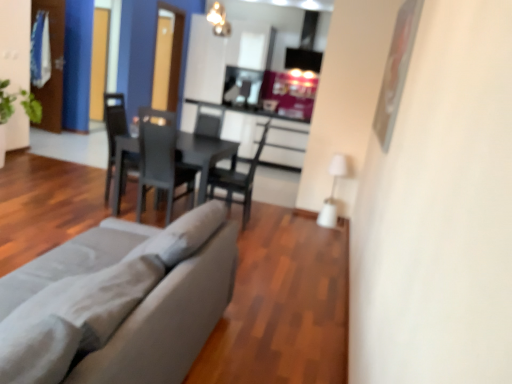
At what (x,y) coordinates should I click in order to perform the action: click on matte gray chair at center, which appears as the 1th chair when viewed from the right. Please return your answer as a coordinate pair (x, y). Image resolution: width=512 pixels, height=384 pixels. Looking at the image, I should click on (238, 179).

Where is `matte black armchair at center`? matte black armchair at center is located at coordinates (209, 120).

The image size is (512, 384). What do you see at coordinates (209, 120) in the screenshot? I see `matte black armchair at center` at bounding box center [209, 120].

Image resolution: width=512 pixels, height=384 pixels. I want to click on matte gray chair at center, which appears as the 1th chair when viewed from the right, so click(238, 179).

How distant is transparent glass door at upper left, which is the 1th glass door in left-to-right order, from black matte table at center?

They are 2.54 meters apart.

Can you confirm if transparent glass door at upper left, which is the 1th glass door in left-to-right order, is positioned to the left of black matte table at center?

Yes.

Can you confirm if transparent glass door at upper left, which is the second glass door in right-to-left order, is thinner than black matte table at center?

Correct, the width of transparent glass door at upper left, which is the second glass door in right-to-left order, is less than that of black matte table at center.

Considering the relative sizes of transparent glass door at upper left, which is the second glass door in right-to-left order, and black matte table at center in the image provided, is transparent glass door at upper left, which is the second glass door in right-to-left order, shorter than black matte table at center?

In fact, transparent glass door at upper left, which is the second glass door in right-to-left order, may be taller than black matte table at center.

From a real-world perspective, relative to matte black armchair at center, is transparent glass door at upper left, positioned as the 1th glass door in right-to-left order, vertically above or below?

In terms of real-world spatial position, transparent glass door at upper left, positioned as the 1th glass door in right-to-left order, is above matte black armchair at center.

Can you confirm if transparent glass door at upper left, positioned as the 2th glass door in left-to-right order, is thinner than matte black armchair at center?

Indeed, transparent glass door at upper left, positioned as the 2th glass door in left-to-right order, has a lesser width compared to matte black armchair at center.

Is transparent glass door at upper left, positioned as the 1th glass door in right-to-left order, facing towards matte black armchair at center?

No, transparent glass door at upper left, positioned as the 1th glass door in right-to-left order, is not aimed at matte black armchair at center.

Does point (181, 38) appear closer or farther from the camera than point (193, 101)?

Point (181, 38) is positioned farther from the camera compared to point (193, 101).

Looking at this image, which of these two, matte gray chair at center, which appears as the 1th chair when viewed from the right, or black matte table at center, is smaller?

matte gray chair at center, which appears as the 1th chair when viewed from the right.

Is matte gray chair at center, which appears as the 1th chair when viewed from the right, looking in the opposite direction of black matte table at center?

No, matte gray chair at center, which appears as the 1th chair when viewed from the right, is not facing away from black matte table at center.

Find the location of a particular element. This screenshot has width=512, height=384. table below the matte gray chair at center, the second chair positioned from the left (from a real-world perspective) is located at coordinates (203, 155).

From the image's perspective, is matte gray chair at center, the second chair positioned from the left, above or below black matte table at center?

Based on their image positions, matte gray chair at center, the second chair positioned from the left, is located above black matte table at center.

Between transparent glass door at upper left, positioned as the 2th glass door in left-to-right order, and matte gray chair at center, which appears as the 1th chair when viewed from the right, which one has smaller width?

With smaller width is transparent glass door at upper left, positioned as the 2th glass door in left-to-right order.

Considering the relative sizes of transparent glass door at upper left, positioned as the 1th glass door in right-to-left order, and matte gray chair at center, which appears as the 1th chair when viewed from the right, in the image provided, is transparent glass door at upper left, positioned as the 1th glass door in right-to-left order, shorter than matte gray chair at center, which appears as the 1th chair when viewed from the right,?

No, transparent glass door at upper left, positioned as the 1th glass door in right-to-left order, is not shorter than matte gray chair at center, which appears as the 1th chair when viewed from the right.

I want to click on the 2nd chair in front of the transparent glass door at upper left, positioned as the 2th glass door in left-to-right order, starting your count from the anchor, so click(238, 179).

How much distance is there between transparent glass door at upper left, positioned as the 2th glass door in left-to-right order, and matte gray chair at center, the second chair positioned from the left?

A distance of 2.43 meters exists between transparent glass door at upper left, positioned as the 2th glass door in left-to-right order, and matte gray chair at center, the second chair positioned from the left.

Considering the sizes of objects black matte table at center and gray fabric couch at lower left in the image provided, who is smaller, black matte table at center or gray fabric couch at lower left?

Smaller between the two is black matte table at center.

Is black matte table at center placed right next to gray fabric couch at lower left?

No.

Is black matte table at center wider than gray fabric couch at lower left?

In fact, black matte table at center might be narrower than gray fabric couch at lower left.

From the image's perspective, would you say black matte table at center is shown under gray fabric couch at lower left?

Incorrect, from the image's perspective, black matte table at center is higher than gray fabric couch at lower left.

Choose the correct answer: Is black matte table at center inside transparent glass door at upper left, positioned as the 1th glass door in right-to-left order, or outside it?

black matte table at center lies outside transparent glass door at upper left, positioned as the 1th glass door in right-to-left order.

Would you consider black matte table at center to be distant from transparent glass door at upper left, positioned as the 2th glass door in left-to-right order?

Yes, black matte table at center and transparent glass door at upper left, positioned as the 2th glass door in left-to-right order, are located far from each other.

Looking at their sizes, would you say black matte table at center is wider or thinner than transparent glass door at upper left, positioned as the 1th glass door in right-to-left order?

In the image, black matte table at center appears to be wider than transparent glass door at upper left, positioned as the 1th glass door in right-to-left order.

From the image's perspective, is black matte table at center located above transparent glass door at upper left, positioned as the 2th glass door in left-to-right order?

No, from the image's perspective, black matte table at center is not above transparent glass door at upper left, positioned as the 2th glass door in left-to-right order.

Is point (180, 27) closer to camera compared to point (129, 227)?

No, it is behind (129, 227).

Which of these two, transparent glass door at upper left, positioned as the 1th glass door in right-to-left order, or gray fabric couch at lower left, is thinner?

Thinner between the two is transparent glass door at upper left, positioned as the 1th glass door in right-to-left order.

Is transparent glass door at upper left, positioned as the 2th glass door in left-to-right order, at the left side of gray fabric couch at lower left?

Yes, transparent glass door at upper left, positioned as the 2th glass door in left-to-right order, is to the left of gray fabric couch at lower left.

This screenshot has width=512, height=384. I want to click on the 2nd glass door positioned above the gray fabric couch at lower left (from a real-world perspective), so click(x=168, y=59).

Locate an element on the screen. The height and width of the screenshot is (384, 512). table in front of the transparent glass door at upper left, which is the 1th glass door in left-to-right order is located at coordinates (203, 155).

The width and height of the screenshot is (512, 384). I want to click on the 1st glass door behind the matte black armchair at center, so click(x=168, y=59).

Based on their spatial positions, is matte gray chair at center, the second chair positioned from the left, or black matte table at center further from matte black armchair at center?

matte gray chair at center, the second chair positioned from the left, is further to matte black armchair at center.

Estimate the real-world distances between objects in this image. Which object is closer to matte black armchair at center, transparent glass door at upper left, positioned as the 1th glass door in right-to-left order, or black matte table at center?

Among the two, transparent glass door at upper left, positioned as the 1th glass door in right-to-left order, is located nearer to matte black armchair at center.

Estimate the real-world distances between objects in this image. Which object is further from matte gray chair at center, which appears as the 1th chair when viewed from the right, black matte table at center or transparent glass door at upper left, which is the 1th glass door in left-to-right order?

Among the two, transparent glass door at upper left, which is the 1th glass door in left-to-right order, is located further to matte gray chair at center, which appears as the 1th chair when viewed from the right.

When comparing their distances from gray fabric couch at lower left, does black matte table at center or matte black chair at center, the 2th chair positioned from the right, seem closer?

black matte table at center is positioned closer to the anchor gray fabric couch at lower left.

Which object lies nearer to the anchor point matte gray chair at center, which appears as the 1th chair when viewed from the right, matte black chair at center, the 2th chair positioned from the right, or transparent glass door at upper left, positioned as the 2th glass door in left-to-right order?

Among the two, matte black chair at center, the 2th chair positioned from the right, is located nearer to matte gray chair at center, which appears as the 1th chair when viewed from the right.

Based on their spatial positions, is transparent glass door at upper left, positioned as the 2th glass door in left-to-right order, or matte gray chair at center, which appears as the 1th chair when viewed from the right, closer to black matte table at center?

Among the two, matte gray chair at center, which appears as the 1th chair when viewed from the right, is located nearer to black matte table at center.

Looking at the image, which one is located closer to matte gray chair at center, the second chair positioned from the left, matte black chair at center, the 2th chair positioned from the right, or matte black armchair at center?

The object closer to matte gray chair at center, the second chair positioned from the left, is matte black chair at center, the 2th chair positioned from the right.

When comparing their distances from gray fabric couch at lower left, does matte black chair at center, marked as the first chair in a left-to-right arrangement, or black matte table at center seem closer?

The object closer to gray fabric couch at lower left is black matte table at center.

Image resolution: width=512 pixels, height=384 pixels. Identify the location of chair between transparent glass door at upper left, which is the 1th glass door in left-to-right order, and matte gray chair at center, which appears as the 1th chair when viewed from the right, from left to right. (113, 129).

Image resolution: width=512 pixels, height=384 pixels. Find the location of `table situated between matte black chair at center, marked as the first chair in a left-to-right arrangement, and matte black armchair at center from left to right`. table situated between matte black chair at center, marked as the first chair in a left-to-right arrangement, and matte black armchair at center from left to right is located at coordinates (203, 155).

This screenshot has height=384, width=512. What are the coordinates of `armchair between transparent glass door at upper left, which is the 1th glass door in left-to-right order, and matte gray chair at center, which appears as the 1th chair when viewed from the right, in the horizontal direction` in the screenshot? It's located at (209, 120).

Find the location of a particular element. Image resolution: width=512 pixels, height=384 pixels. armchair between black matte table at center and transparent glass door at upper left, positioned as the 1th glass door in right-to-left order, along the z-axis is located at coordinates (209, 120).